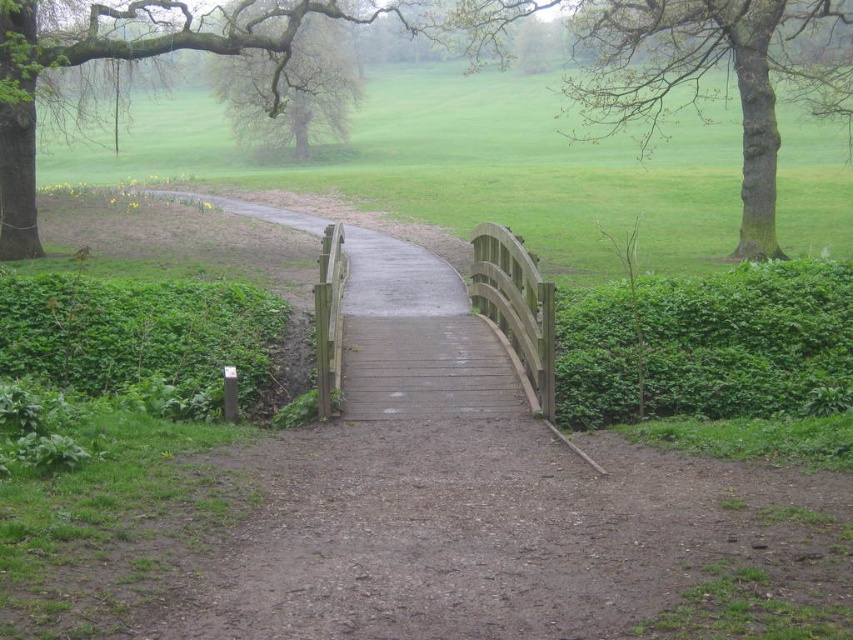
Question: In this image, where is green leafy hedge at right located relative to green rough bark tree at upper right?

Choices:
 (A) above
 (B) below

Answer: (B)

Question: Does green leafy hedge at right appear on the left side of smooth brown tree at upper center?

Choices:
 (A) no
 (B) yes

Answer: (A)

Question: Which point is farther to the camera?

Choices:
 (A) green leafy hedge at lower left
 (B) green rough bark tree at upper right

Answer: (B)

Question: Which point appears farthest from the camera in this image?

Choices:
 (A) click(120, 337)
 (B) click(248, 136)
 (C) click(662, 326)
 (D) click(842, 86)

Answer: (B)

Question: Which of the following is the farthest from the observer?

Choices:
 (A) green leafy hedge at lower left
 (B) smooth brown tree at upper center

Answer: (B)

Question: Is the position of green leafy hedge at right less distant than that of smooth brown tree at upper center?

Choices:
 (A) yes
 (B) no

Answer: (A)